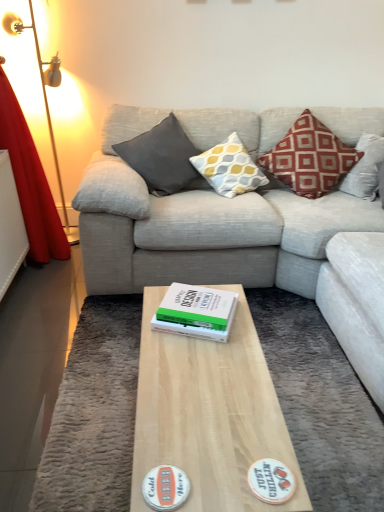
This screenshot has height=512, width=384. Find the location of `white matte sticker at center, which is the 1th sticker in right-to-left order`. white matte sticker at center, which is the 1th sticker in right-to-left order is located at coordinates (271, 481).

Where is `red velvet curtain at left`? This screenshot has height=512, width=384. red velvet curtain at left is located at coordinates (30, 182).

Locate an element on the screen. matte gray cushion at center, the first pillow when ordered from left to right is located at coordinates (163, 158).

How much space does matte gray cushion at center, arranged as the 3th pillow when viewed from the right, occupy horizontally?

The width of matte gray cushion at center, arranged as the 3th pillow when viewed from the right, is 15.39 inches.

Image resolution: width=384 pixels, height=512 pixels. Describe the element at coordinates (165, 487) in the screenshot. I see `matte white coaster at lower center, placed as the 1th sticker when sorted from left to right` at that location.

Locate an element on the screen. The width and height of the screenshot is (384, 512). matte white coaster at lower center, which ranks as the 2th sticker in right-to-left order is located at coordinates (165, 487).

This screenshot has height=512, width=384. What are the coordinates of `yellow and gray patterned cushion at center, the second pillow in the right-to-left sequence` in the screenshot? It's located at (229, 168).

The image size is (384, 512). What do you see at coordinates (209, 414) in the screenshot?
I see `light wood coffee table at center` at bounding box center [209, 414].

Locate an element on the screen. white matte sticker at center, which is the 1th sticker in right-to-left order is located at coordinates (271, 481).

Based on their sizes in the image, would you say red cotton pillow at upper right, placed as the first pillow when sorted from right to left, is bigger or smaller than matte gray cushion at center, arranged as the 3th pillow when viewed from the right?

Considering their sizes, red cotton pillow at upper right, placed as the first pillow when sorted from right to left, takes up more space than matte gray cushion at center, arranged as the 3th pillow when viewed from the right.

Does red cotton pillow at upper right, placed as the first pillow when sorted from right to left, have a greater width compared to matte gray cushion at center, the first pillow when ordered from left to right?

Yes.

Does red cotton pillow at upper right, positioned as the 3th pillow in left-to-right order, come behind matte gray cushion at center, arranged as the 3th pillow when viewed from the right?

That is True.

Do you think red cotton pillow at upper right, placed as the first pillow when sorted from right to left, is within matte gray cushion at center, arranged as the 3th pillow when viewed from the right, or outside of it?

red cotton pillow at upper right, placed as the first pillow when sorted from right to left, is not enclosed by matte gray cushion at center, arranged as the 3th pillow when viewed from the right.

Consider the image. Can you tell me how much light wood coffee table at center and matte gray cushion at center, arranged as the 3th pillow when viewed from the right, differ in facing direction?

There is a 92-degree angle between the facing directions of light wood coffee table at center and matte gray cushion at center, arranged as the 3th pillow when viewed from the right.

From a real-world perspective, is light wood coffee table at center physically located above or below matte gray cushion at center, the first pillow when ordered from left to right?

In terms of real-world spatial position, light wood coffee table at center is below matte gray cushion at center, the first pillow when ordered from left to right.

Is light wood coffee table at center positioned far away from matte gray cushion at center, arranged as the 3th pillow when viewed from the right?

Yes.

From a real-world perspective, who is located lower, red velvet curtain at left or white paper at center?

white paper at center.

Considering the sizes of objects red velvet curtain at left and white paper at center in the image provided, who is smaller, red velvet curtain at left or white paper at center?

Smaller between the two is white paper at center.

How different are the orientations of red velvet curtain at left and white paper at center in degrees?

The angular difference between red velvet curtain at left and white paper at center is 109 degrees.

Considering the relative sizes of yellow and gray patterned cushion at center, which is the 2th pillow in left-to-right order, and red cotton pillow at upper right, placed as the first pillow when sorted from right to left, in the image provided, is yellow and gray patterned cushion at center, which is the 2th pillow in left-to-right order, shorter than red cotton pillow at upper right, placed as the first pillow when sorted from right to left,?

Yes.

How many degrees apart are the facing directions of yellow and gray patterned cushion at center, the second pillow in the right-to-left sequence, and red cotton pillow at upper right, positioned as the 3th pillow in left-to-right order?

yellow and gray patterned cushion at center, the second pillow in the right-to-left sequence, and red cotton pillow at upper right, positioned as the 3th pillow in left-to-right order, are facing 0.0011 degrees away from each other.

Identify the location of the 2nd pillow above when counting from the yellow and gray patterned cushion at center, the second pillow in the right-to-left sequence (from the image's perspective). (309, 158).

In the scene shown: Is red cotton pillow at upper right, placed as the first pillow when sorted from right to left, a part of yellow and gray patterned cushion at center, which is the 2th pillow in left-to-right order?

No, red cotton pillow at upper right, placed as the first pillow when sorted from right to left, is not inside yellow and gray patterned cushion at center, which is the 2th pillow in left-to-right order.

Considering the sizes of objects white matte sticker at center, which is the 1th sticker in right-to-left order, and light wood coffee table at center in the image provided, who is smaller, white matte sticker at center, which is the 1th sticker in right-to-left order, or light wood coffee table at center?

Smaller between the two is white matte sticker at center, which is the 1th sticker in right-to-left order.

Based on the photo, is white matte sticker at center, which is the 1th sticker in right-to-left order, far from light wood coffee table at center?

No, white matte sticker at center, which is the 1th sticker in right-to-left order, is not far away from light wood coffee table at center.

Is point (288, 483) positioned behind point (198, 474)?

No, it is in front of (198, 474).

Is yellow and gray patterned cushion at center, which is the 2th pillow in left-to-right order, placed right next to red velvet curtain at left?

No, yellow and gray patterned cushion at center, which is the 2th pillow in left-to-right order, is not in contact with red velvet curtain at left.

Can you tell me how much yellow and gray patterned cushion at center, the second pillow in the right-to-left sequence, and red velvet curtain at left differ in facing direction?

91.9 degrees.

From a real-world perspective, relative to red velvet curtain at left, is yellow and gray patterned cushion at center, which is the 2th pillow in left-to-right order, vertically above or below?

From a real-world perspective, yellow and gray patterned cushion at center, which is the 2th pillow in left-to-right order, is physically below red velvet curtain at left.

Based on the photo, from a real-world perspective, which object rests below the other?

matte gray cushion at center, the first pillow when ordered from left to right.

Could you tell me if matte gray cushion at center, the first pillow when ordered from left to right, is facing red velvet curtain at left?

No, matte gray cushion at center, the first pillow when ordered from left to right, is not oriented towards red velvet curtain at left.

From the image's perspective, which object appears higher, matte gray cushion at center, arranged as the 3th pillow when viewed from the right, or red velvet curtain at left?

matte gray cushion at center, arranged as the 3th pillow when viewed from the right, is shown above in the image.

Is matte gray cushion at center, arranged as the 3th pillow when viewed from the right, completely or partially outside of red velvet curtain at left?

Absolutely, matte gray cushion at center, arranged as the 3th pillow when viewed from the right, is external to red velvet curtain at left.

Where is `pillow that is the 1st one when counting downward from the red cotton pillow at upper right, placed as the first pillow when sorted from right to left (from the image's perspective)`? The width and height of the screenshot is (384, 512). pillow that is the 1st one when counting downward from the red cotton pillow at upper right, placed as the first pillow when sorted from right to left (from the image's perspective) is located at coordinates (163, 158).

Locate an element on the screen. coffee table in front of the matte gray cushion at center, the first pillow when ordered from left to right is located at coordinates (209, 414).

Which object lies nearer to the anchor point light gray fabric couch at center, white matte sticker at center, the second sticker in the left-to-right sequence, or matte white coaster at lower center, placed as the 1th sticker when sorted from left to right?

white matte sticker at center, the second sticker in the left-to-right sequence, lies closer to light gray fabric couch at center than the other object.

From the image, which object appears to be farther from matte gray cushion at center, arranged as the 3th pillow when viewed from the right, red velvet curtain at left or white matte sticker at center, the second sticker in the left-to-right sequence?

Based on the image, white matte sticker at center, the second sticker in the left-to-right sequence, appears to be further to matte gray cushion at center, arranged as the 3th pillow when viewed from the right.

Looking at the image, which one is located further to matte gray cushion at center, the first pillow when ordered from left to right, white paper at center or white matte sticker at center, which is the 1th sticker in right-to-left order?

white matte sticker at center, which is the 1th sticker in right-to-left order.

Considering their positions, is white matte sticker at center, which is the 1th sticker in right-to-left order, positioned closer to red velvet curtain at left than white paper at center?

Among the two, white paper at center is located nearer to red velvet curtain at left.

From the image, which object appears to be farther from matte white coaster at lower center, which ranks as the 2th sticker in right-to-left order, white matte sticker at center, which is the 1th sticker in right-to-left order, or matte gray cushion at center, the first pillow when ordered from left to right?

Based on the image, matte gray cushion at center, the first pillow when ordered from left to right, appears to be further to matte white coaster at lower center, which ranks as the 2th sticker in right-to-left order.

From the image, which object appears to be nearer to light wood coffee table at center, white paper at center or matte gray cushion at center, arranged as the 3th pillow when viewed from the right?

white paper at center is closer to light wood coffee table at center.

Which object lies further to the anchor point light gray fabric couch at center, matte gray cushion at center, the first pillow when ordered from left to right, or white paper at center?

Based on the image, white paper at center appears to be further to light gray fabric couch at center.

Looking at the image, which one is located closer to yellow and gray patterned cushion at center, the second pillow in the right-to-left sequence, light wood coffee table at center or white paper at center?

Among the two, white paper at center is located nearer to yellow and gray patterned cushion at center, the second pillow in the right-to-left sequence.

You are a GUI agent. You are given a task and a screenshot of the screen. Output one action in this format:
    pyautogui.click(x=<x>, y=<y>)
    Task: Click on the sticker between light wood coffee table at center and yellow and gray patterned cushion at center, which is the 2th pillow in left-to-right order, in the front-back direction
    
    Given the screenshot: What is the action you would take?
    pyautogui.click(x=271, y=481)

What are the coordinates of `sticker between matte white coaster at lower center, placed as the 1th sticker when sorted from left to right, and matte gray cushion at center, arranged as the 3th pillow when viewed from the right, along the z-axis` in the screenshot? It's located at (271, 481).

The height and width of the screenshot is (512, 384). What are the coordinates of `sticker between light wood coffee table at center and matte gray cushion at center, the first pillow when ordered from left to right, in the front-back direction` in the screenshot? It's located at (271, 481).

Locate an element on the screen. The width and height of the screenshot is (384, 512). sticker located between light wood coffee table at center and white paper at center in the depth direction is located at coordinates (271, 481).